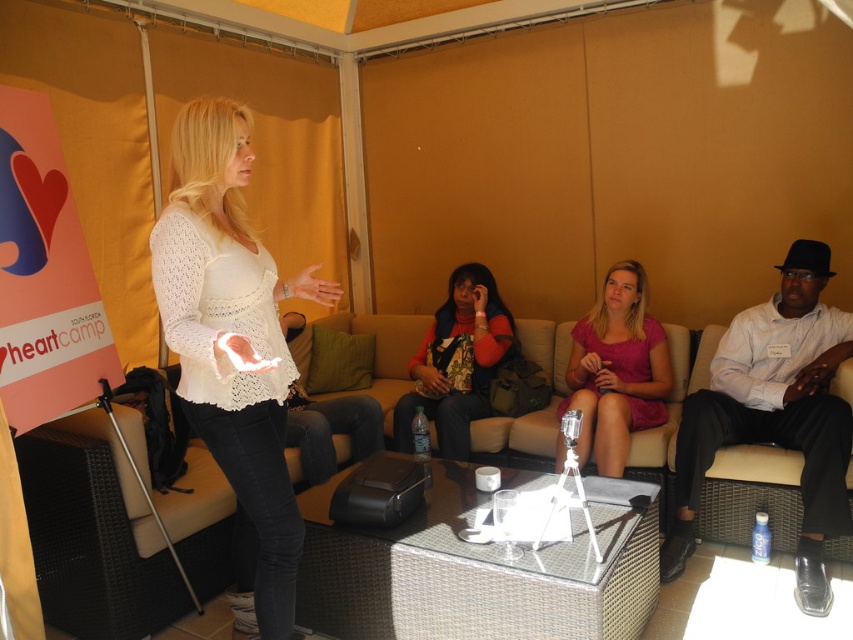
You are sitting in the conference room and want to determine which of the two points, point (795, 596) or point (573, 369), is nearer to you. Which one is closer?

Result: Point (795, 596) is closer to the viewer than point (573, 369).

You are an interior designer assessing the space for seating arrangements. The beige wicker couch at center and the white lace top at center are both in the room. Which object is taller?

The white lace top at center is taller than the beige wicker couch at center.

You are organizing a photo shoot and need to place a 1.5m tall mannequin on the beige wicker couch at center. Considering the height of the couch and the white shirt at center, will the mannequin be visible over the couch?

The beige wicker couch at center has a lesser height compared to white shirt at center. Since the white shirt at center is taller than the couch, the mannequin placed on the beige wicker couch at center might not be fully visible if the white shirt at center is in the foreground.